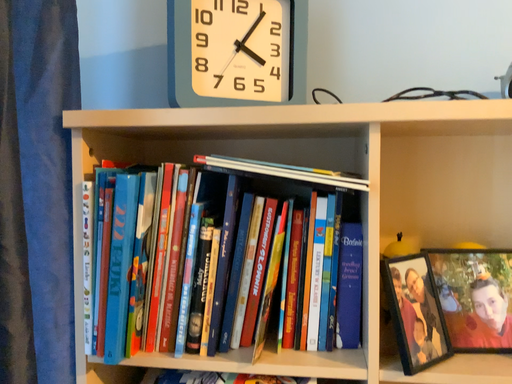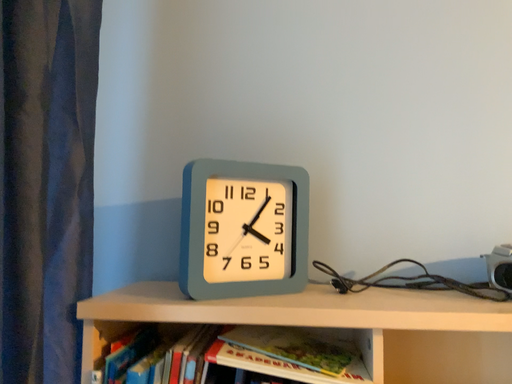
Question: Which way did the camera rotate in the video?

Choices:
 (A) rotated upward
 (B) rotated downward

Answer: (A)